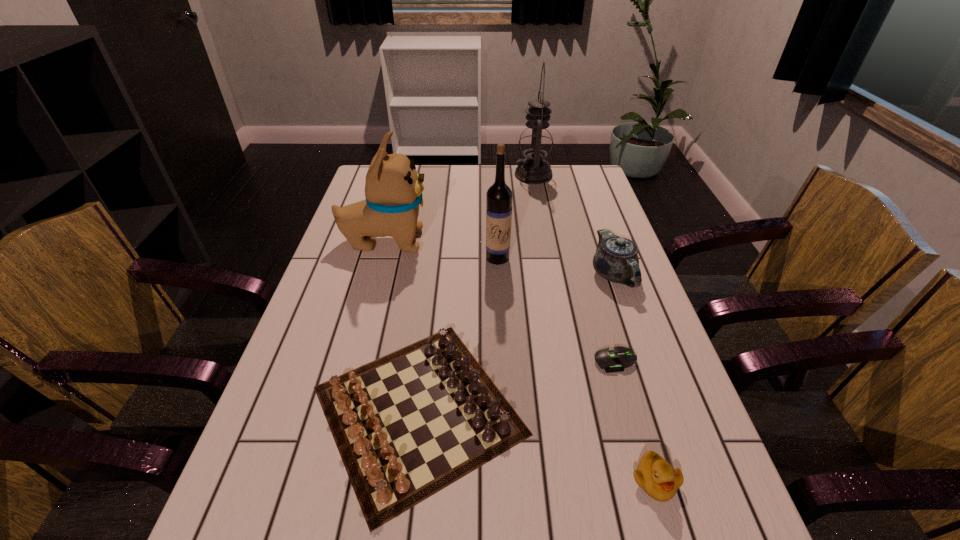
Locate an element on the screen. free space between the shortest object and the duckling is located at coordinates (635, 421).

Where is `free space between the shortest object and the wine bottle`? The width and height of the screenshot is (960, 540). free space between the shortest object and the wine bottle is located at coordinates (556, 309).

Find the location of a particular element. The width and height of the screenshot is (960, 540). unoccupied position between the sixth tallest object and the wine bottle is located at coordinates (576, 369).

This screenshot has height=540, width=960. Find the location of `free spot between the wine bottle and the farthest object`. free spot between the wine bottle and the farthest object is located at coordinates 516,216.

The height and width of the screenshot is (540, 960). I want to click on vacant region between the oil lamp and the chessboard, so click(x=476, y=292).

Locate an element on the screen. object that stands as the closest to the computer mouse is located at coordinates (407, 425).

Locate an element on the screen. object that is the fifth closest to the farthest object is located at coordinates (611, 360).

The width and height of the screenshot is (960, 540). Find the location of `free location that satisfies the following two spatial constraints: 1. on the label of the wine bottle; 2. on the left side of the computer mouse`. free location that satisfies the following two spatial constraints: 1. on the label of the wine bottle; 2. on the left side of the computer mouse is located at coordinates (503, 361).

Where is `free spot that satisfies the following two spatial constraints: 1. on the label of the wine bottle; 2. on the right side of the computer mouse`? free spot that satisfies the following two spatial constraints: 1. on the label of the wine bottle; 2. on the right side of the computer mouse is located at coordinates (503, 361).